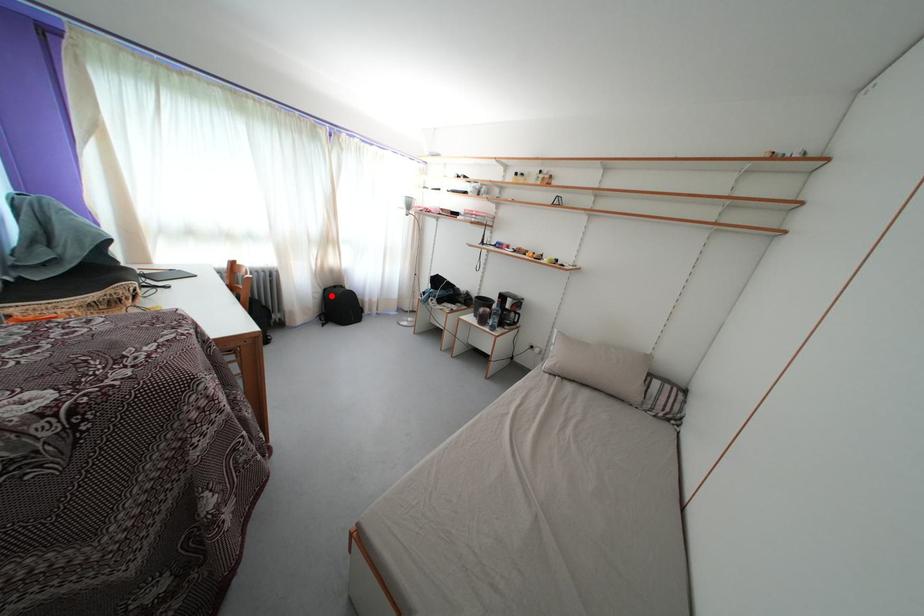
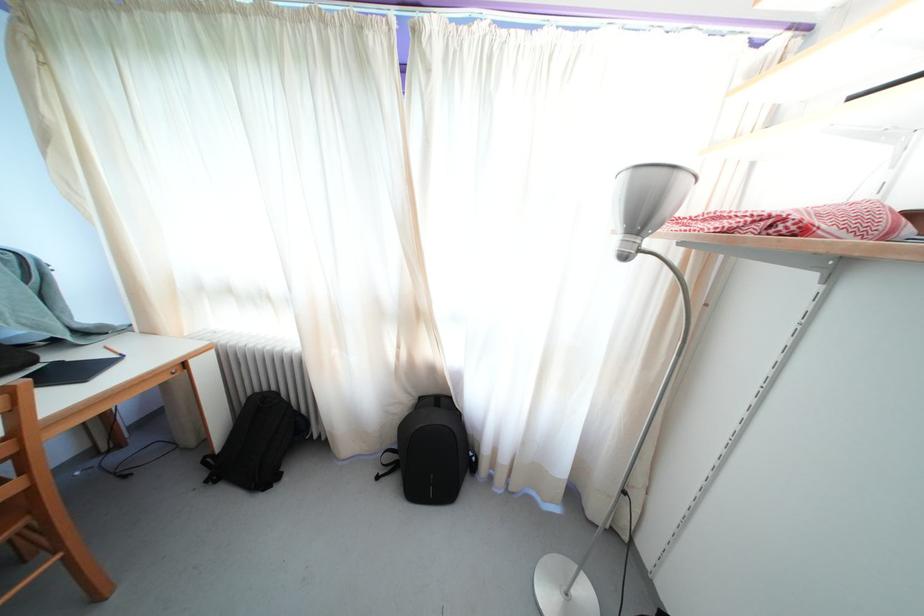
Question: I am providing you with two images of the same scene from different viewpoints. A red point is shown in image1. For the corresponding object point in image2, is it positioned nearer or farther from the camera?

Choices:
 (A) Nearer
 (B) Farther

Answer: (B)